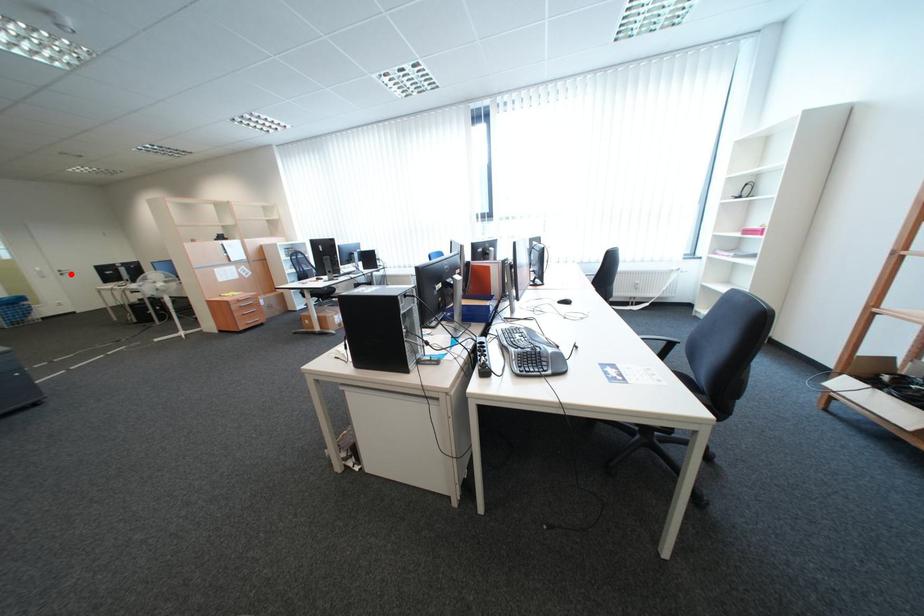
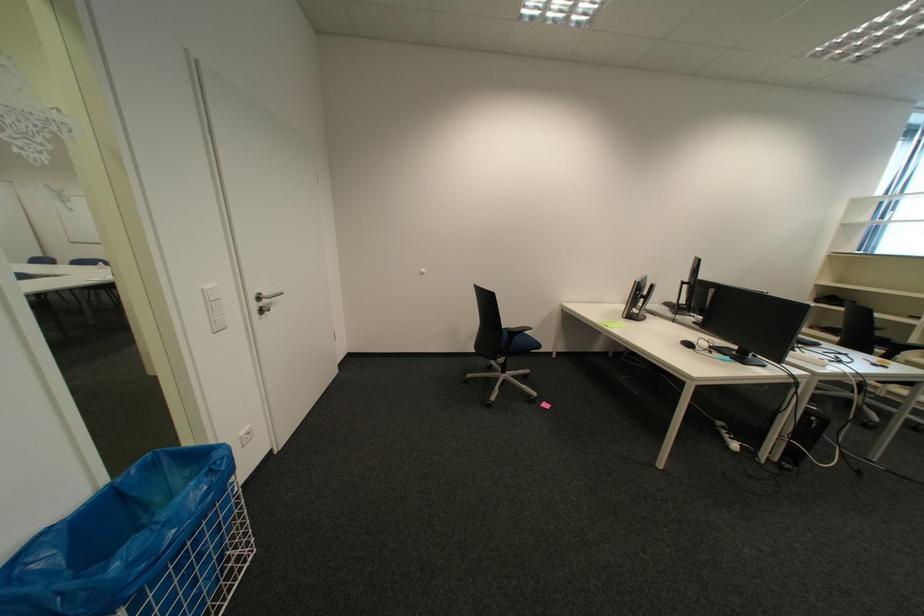
The point at the highlighted location is marked in the first image. Where is the corresponding point in the second image?

(266, 307)